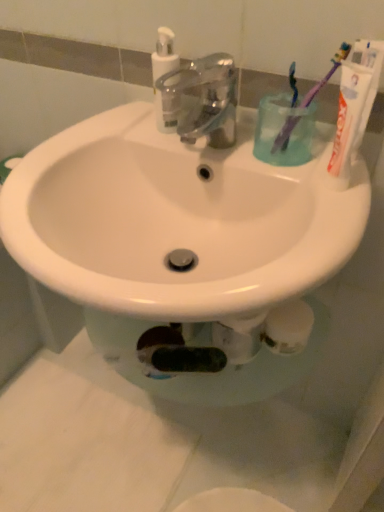
What are the coordinates of `vacant area located to the right-hand side of translucent plastic pump bottle at upper center` in the screenshot? It's located at (242, 143).